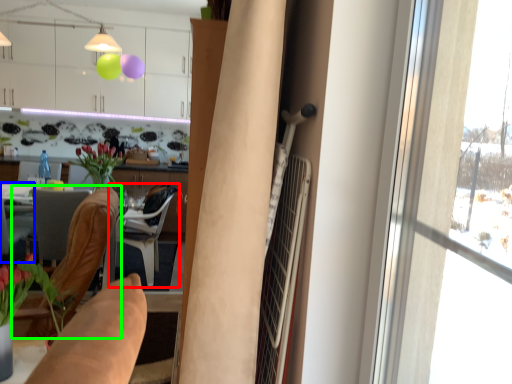
Question: Considering the real-world distances, which object is closest to chair (highlighted by a red box)? chair (highlighted by a blue box) or chair (highlighted by a green box).

Choices:
 (A) chair
 (B) chair

Answer: (A)